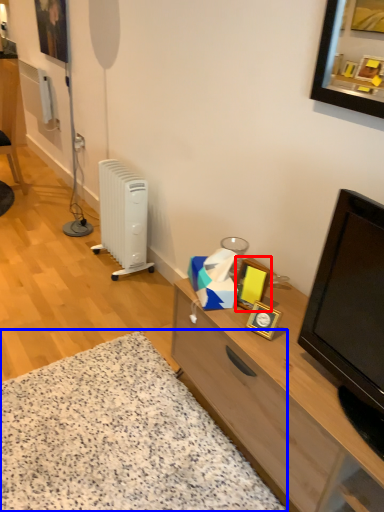
Question: Which object is further to the camera taking this photo, picture frame (highlighted by a red box) or plain (highlighted by a blue box)?

Choices:
 (A) picture frame
 (B) plain

Answer: (A)